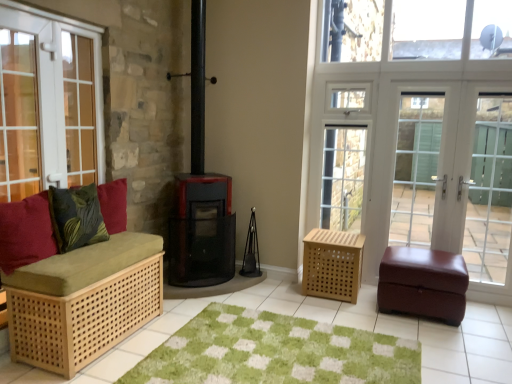
Where is `empty space that is in between natural wood bench at left, which is the third furniture from right to left, and black mesh wood burning stove at center`? Image resolution: width=512 pixels, height=384 pixels. empty space that is in between natural wood bench at left, which is the third furniture from right to left, and black mesh wood burning stove at center is located at coordinates (170, 317).